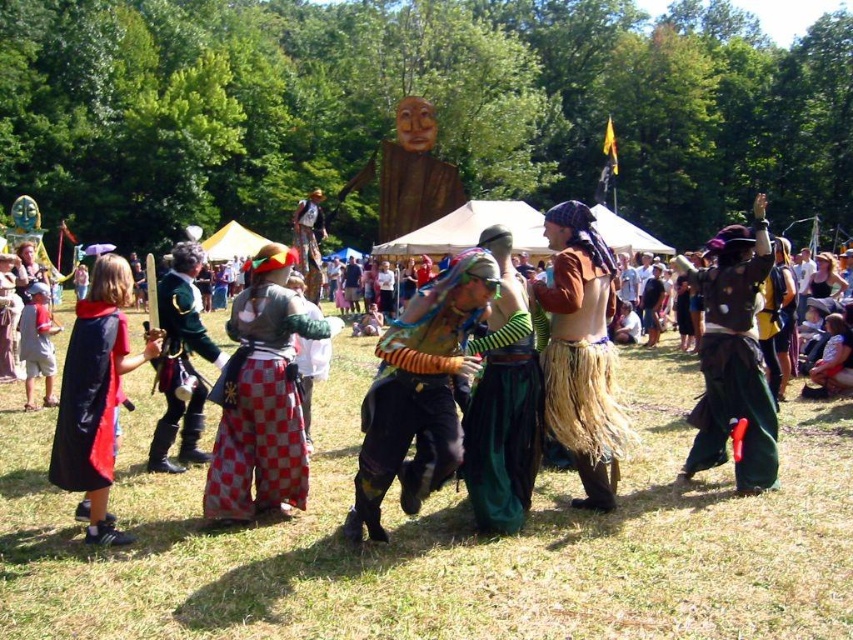
Image resolution: width=853 pixels, height=640 pixels. What do you see at coordinates (579, 362) in the screenshot? I see `brown leather vest at center` at bounding box center [579, 362].

Between brown leather vest at center and green velvet jacket at center, which one is positioned higher?

Positioned higher is brown leather vest at center.

Is point (547, 400) behind point (167, 300)?

No, it is not.

You are a GUI agent. You are given a task and a screenshot of the screen. Output one action in this format:
    pyautogui.click(x=<x>, y=<y>)
    Task: Click on the brown leather vest at center
    The image size is (853, 640).
    Given the screenshot: What is the action you would take?
    pyautogui.click(x=579, y=362)

From the picture: Is green velvet jacket at center wider than red velvet cape at lower left?

Yes.

Where is `green velvet jacket at center`? Image resolution: width=853 pixels, height=640 pixels. green velvet jacket at center is located at coordinates (180, 368).

How distant is green woven skirt at center from brown leather vest at center?

green woven skirt at center and brown leather vest at center are 38.92 centimeters apart.

Does point (490, 237) come farther from viewer compared to point (589, 480)?

That is False.

Between point (511, 465) and point (583, 369), which one is positioned in front?

Point (511, 465)

This screenshot has width=853, height=640. I want to click on green woven skirt at center, so click(503, 403).